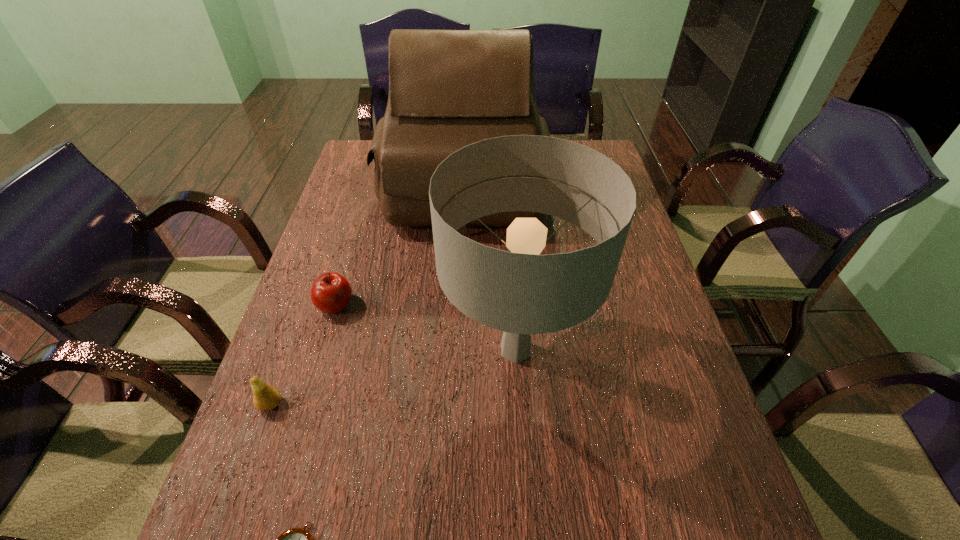
Locate which object is the second closest to the satchel. Please provide its 2D coordinates. Your answer should be formatted as a tuple, i.e. [(x, y)], where the tuple contains the x and y coordinates of a point satisfying the conditions above.

[(521, 293)]

Find the location of `object that stands as the second closest to the lampshade`. object that stands as the second closest to the lampshade is located at coordinates (331, 292).